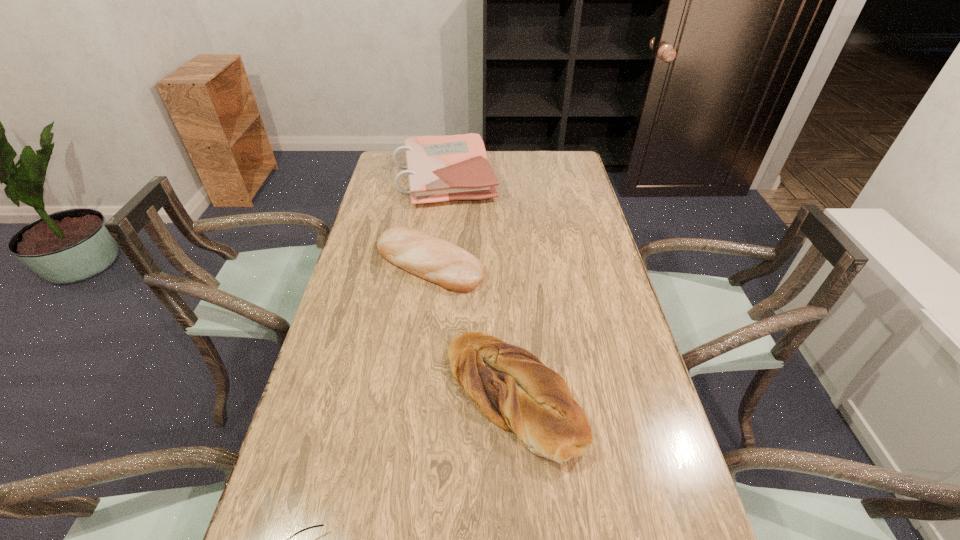
Where is `the third closest object relative to the shortest object`? This screenshot has height=540, width=960. the third closest object relative to the shortest object is located at coordinates (440, 168).

I want to click on object that can be found as the second closest to the farther bread, so click(440, 168).